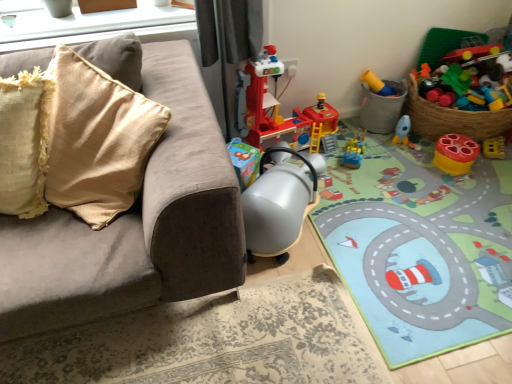
Find the location of `free space between matte plastic toy at right, marked as the second toy in a right-to-left arrangement, and matte plastic rocket at lower right, the fourth toy positioned from the left`. free space between matte plastic toy at right, marked as the second toy in a right-to-left arrangement, and matte plastic rocket at lower right, the fourth toy positioned from the left is located at coordinates (425, 154).